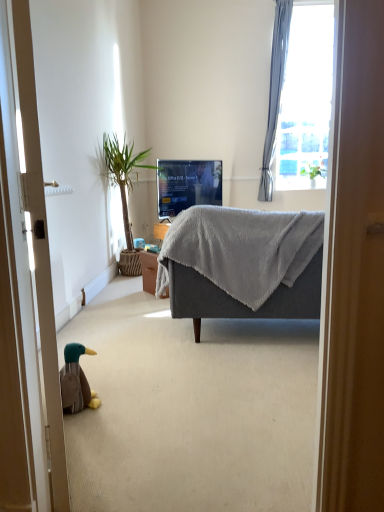
Question: Does matte black tv at center have a greater height compared to green leafy plant at left?

Choices:
 (A) no
 (B) yes

Answer: (A)

Question: From the image's perspective, is matte black tv at center above green leafy plant at left?

Choices:
 (A) yes
 (B) no

Answer: (A)

Question: Considering the relative positions of matte black tv at center and green leafy plant at left in the image provided, is matte black tv at center to the left of green leafy plant at left from the viewer's perspective?

Choices:
 (A) yes
 (B) no

Answer: (B)

Question: From a real-world perspective, is matte black tv at center located higher than green leafy plant at left?

Choices:
 (A) no
 (B) yes

Answer: (B)

Question: Could you tell me if matte black tv at center is turned towards green leafy plant at left?

Choices:
 (A) no
 (B) yes

Answer: (A)

Question: Considering the positions of point (195, 234) and point (218, 179), is point (195, 234) closer or farther from the camera than point (218, 179)?

Choices:
 (A) farther
 (B) closer

Answer: (B)

Question: Is gray soft fabric couch at center inside or outside of matte black tv at center?

Choices:
 (A) inside
 (B) outside

Answer: (B)

Question: From their relative heights in the image, would you say gray soft fabric couch at center is taller or shorter than matte black tv at center?

Choices:
 (A) short
 (B) tall

Answer: (B)

Question: Is gray soft fabric couch at center to the left or to the right of matte black tv at center in the image?

Choices:
 (A) right
 (B) left

Answer: (A)

Question: In terms of width, does brown plush duck at lower left look wider or thinner when compared to wooden door at left?

Choices:
 (A) wide
 (B) thin

Answer: (A)

Question: From their relative heights in the image, would you say brown plush duck at lower left is taller or shorter than wooden door at left?

Choices:
 (A) short
 (B) tall

Answer: (A)

Question: Relative to wooden door at left, is brown plush duck at lower left in front or behind?

Choices:
 (A) front
 (B) behind

Answer: (B)

Question: From a real-world perspective, is brown plush duck at lower left physically located above or below wooden door at left?

Choices:
 (A) below
 (B) above

Answer: (A)

Question: Considering the positions of matte black tv at center and wooden door at left in the image, is matte black tv at center wider or thinner than wooden door at left?

Choices:
 (A) thin
 (B) wide

Answer: (B)

Question: Considering the relative positions of matte black tv at center and wooden door at left in the image provided, is matte black tv at center to the left or to the right of wooden door at left?

Choices:
 (A) right
 (B) left

Answer: (A)